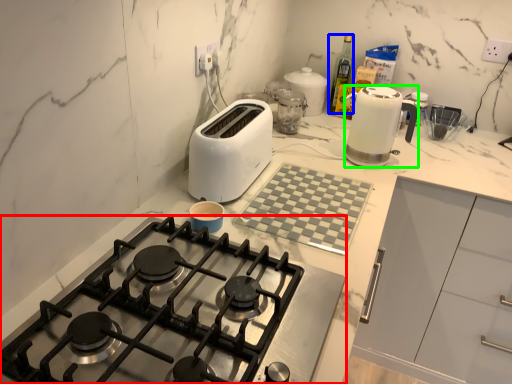
Question: Which object is the farthest from gas stove (highlighted by a red box)? Choose among these: bottle (highlighted by a blue box) or kitchen appliance (highlighted by a green box).

Choices:
 (A) bottle
 (B) kitchen appliance

Answer: (A)